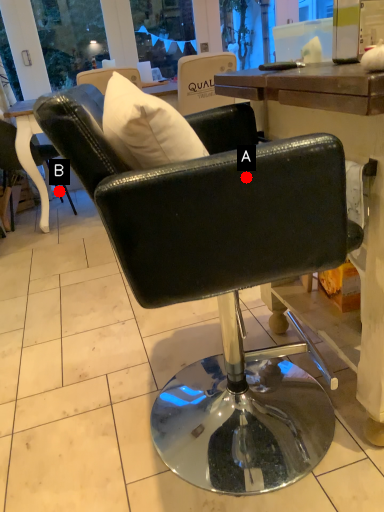
Question: Two points are circled on the image, labeled by A and B beside each circle. Which point is farther to the camera?

Choices:
 (A) A is further
 (B) B is further

Answer: (B)